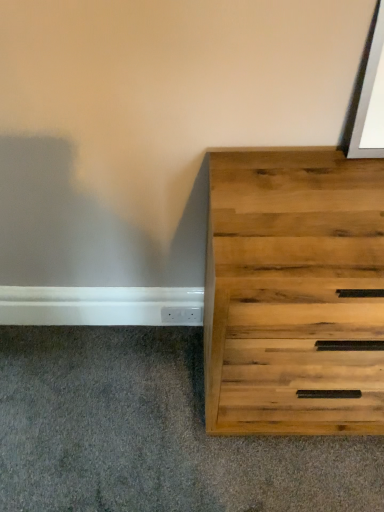
This screenshot has width=384, height=512. Identify the location of natural wood chest of drawers at lower right. (294, 293).

Image resolution: width=384 pixels, height=512 pixels. What do you see at coordinates (294, 293) in the screenshot?
I see `natural wood chest of drawers at lower right` at bounding box center [294, 293].

This screenshot has height=512, width=384. Find the location of `natural wood chest of drawers at lower right`. natural wood chest of drawers at lower right is located at coordinates [x=294, y=293].